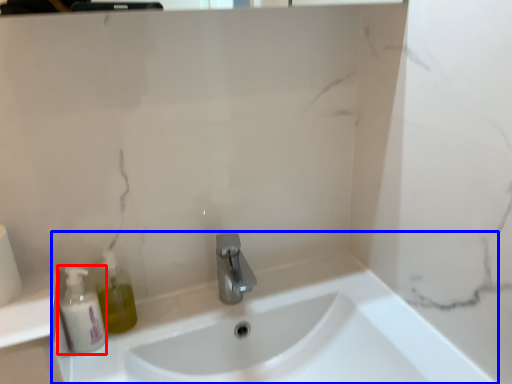
Question: Which object appears farthest to the camera in this image, mouthwash (highlighted by a red box) or sink (highlighted by a blue box)?

Choices:
 (A) mouthwash
 (B) sink

Answer: (A)